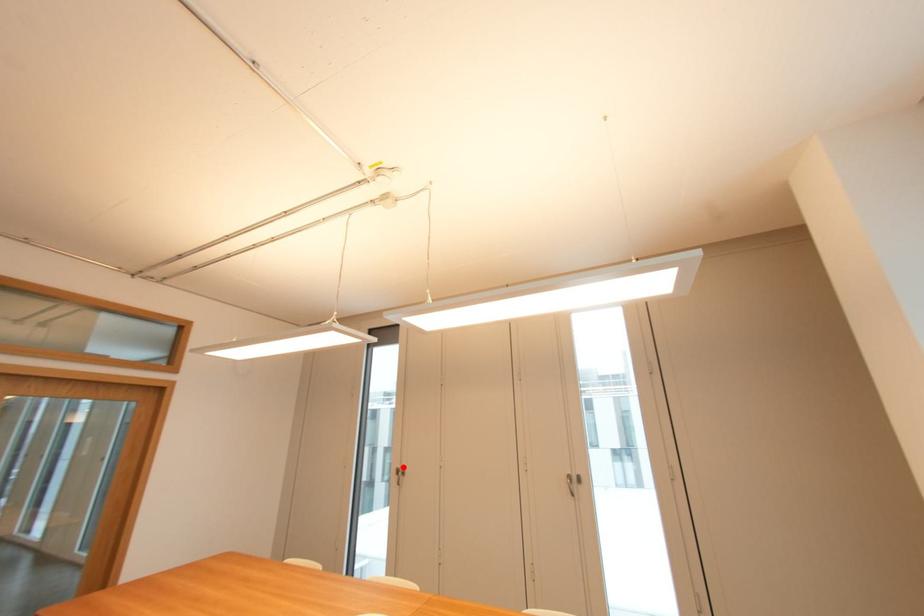
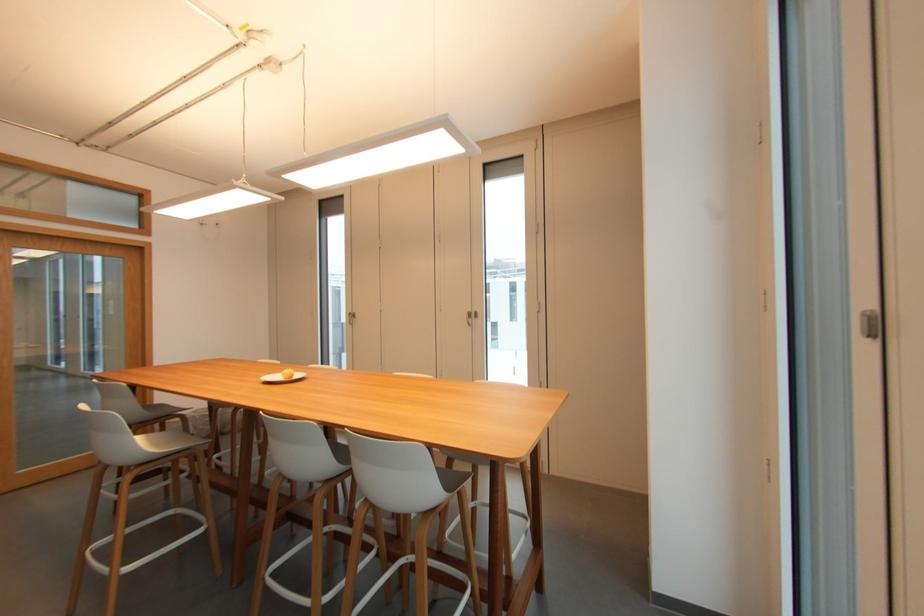
In the second image, find the point that corresponds to the highlighted location in the first image.

(354, 312)